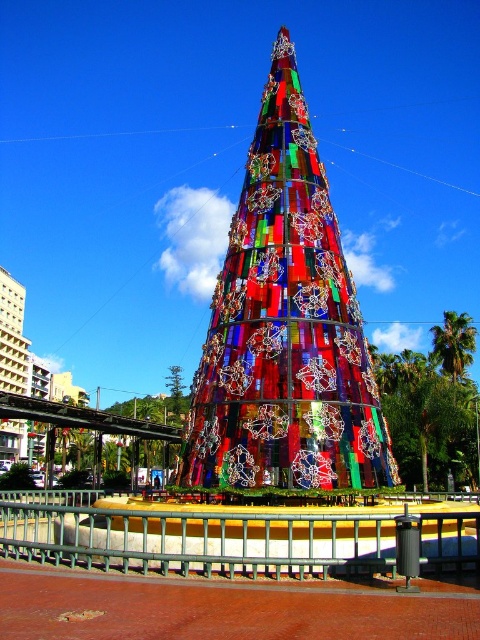
Find the location of `stained glass tree at center`. stained glass tree at center is located at coordinates (285, 328).

Is stained glass tree at center wider than stained glass christmas tree at center?

Incorrect, stained glass tree at center's width does not surpass stained glass christmas tree at center's.

Where is `stained glass tree at center`? stained glass tree at center is located at coordinates (285, 328).

Find the location of a particular element. This screenshot has width=480, height=640. stained glass tree at center is located at coordinates [285, 328].